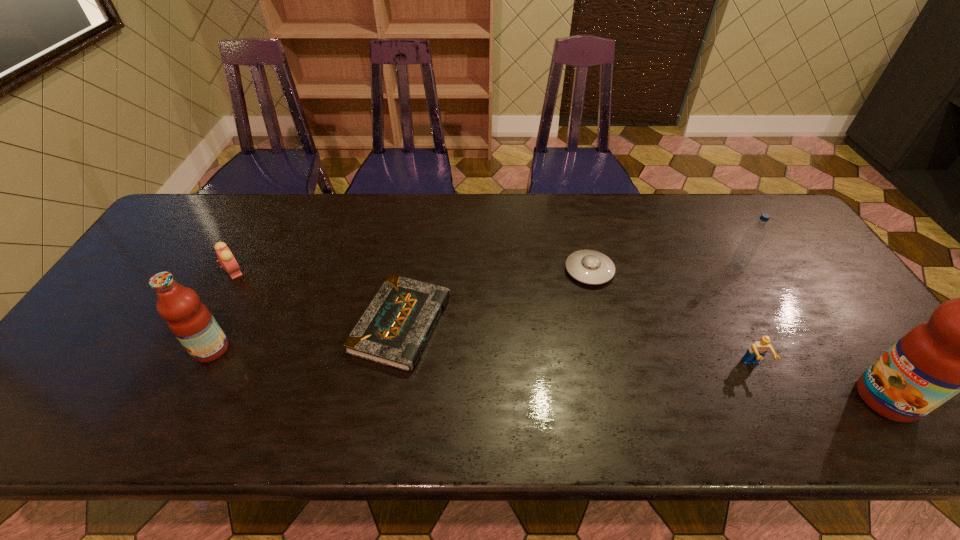
I want to click on the sixth shortest object, so (191, 322).

The image size is (960, 540). I want to click on the shorter fruit juice, so click(x=191, y=322).

What are the coordinates of `the taller fruit juice` in the screenshot? It's located at (959, 349).

Where is `the rightmost object`? This screenshot has width=960, height=540. the rightmost object is located at coordinates (959, 349).

Locate an element on the screen. the sixth object from left to right is located at coordinates click(x=753, y=237).

Where is `the fifth shortest object`? the fifth shortest object is located at coordinates (753, 237).

You are a GUI agent. You are given a task and a screenshot of the screen. Output one action in this format:
    pyautogui.click(x=<x>, y=<y>)
    Task: Click on the fourth object from right to left
    This screenshot has width=960, height=540.
    Given the screenshot: What is the action you would take?
    pyautogui.click(x=590, y=267)

Locate an element on the screen. This screenshot has width=960, height=540. saucer is located at coordinates (590, 267).

Find the location of a particular element. This screenshot has width=960, height=540. the shortest object is located at coordinates (393, 331).

I want to click on the third object from left to right, so tap(393, 331).